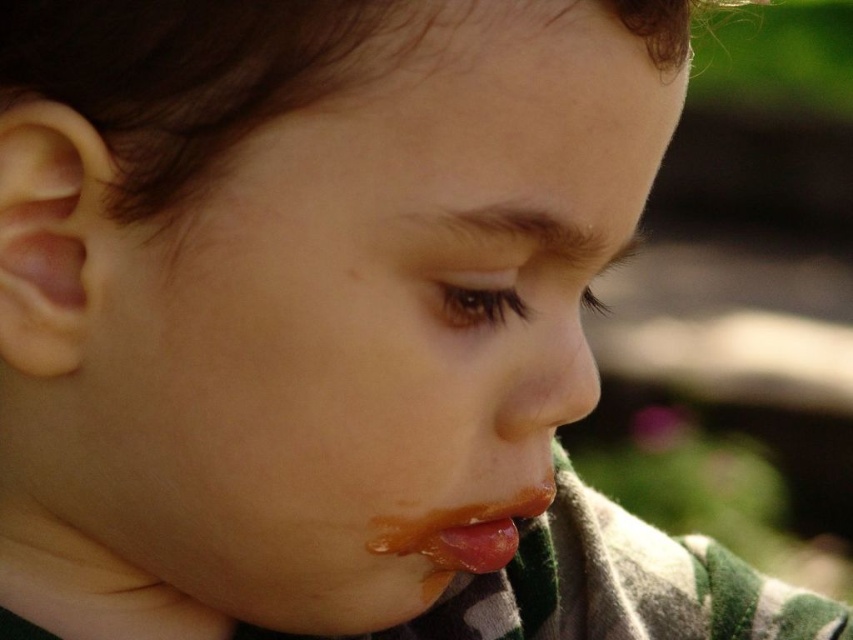
Question: Considering the relative positions of smooth skin face at center and glossy orange lips at lower center in the image provided, where is smooth skin face at center located with respect to glossy orange lips at lower center?

Choices:
 (A) below
 (B) above

Answer: (B)

Question: Can you confirm if smooth skin face at center is wider than glossy orange lips at lower center?

Choices:
 (A) no
 (B) yes

Answer: (B)

Question: Which point is farther to the camera?

Choices:
 (A) smooth skin face at center
 (B) glossy orange lips at lower center

Answer: (B)

Question: Which object appears closest to the camera in this image?

Choices:
 (A) glossy orange lips at lower center
 (B) smooth skin face at center

Answer: (B)

Question: Is smooth skin face at center positioned at the back of glossy orange lips at lower center?

Choices:
 (A) no
 (B) yes

Answer: (A)